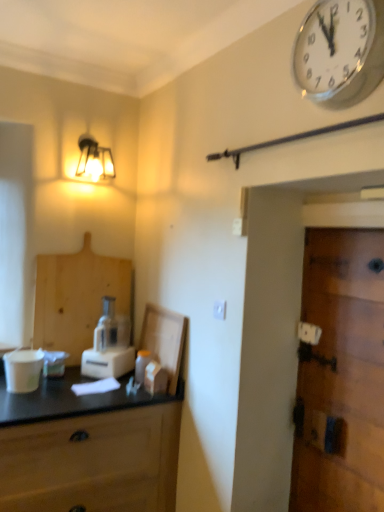
Question: Should I look upward or downward to see white plastic electric outlet at center?

Choices:
 (A) up
 (B) down

Answer: (B)

Question: Does translucent plastic bottle at center turn towards white glossy wall clock at upper right?

Choices:
 (A) no
 (B) yes

Answer: (A)

Question: Is translucent plastic bottle at center smaller than white glossy wall clock at upper right?

Choices:
 (A) yes
 (B) no

Answer: (A)

Question: Would you say translucent plastic bottle at center contains white glossy wall clock at upper right?

Choices:
 (A) yes
 (B) no

Answer: (B)

Question: Is translucent plastic bottle at center next to white glossy wall clock at upper right and touching it?

Choices:
 (A) yes
 (B) no

Answer: (B)

Question: Does translucent plastic bottle at center have a lesser height compared to white glossy wall clock at upper right?

Choices:
 (A) yes
 (B) no

Answer: (A)

Question: Is translucent plastic bottle at center bigger than white glossy wall clock at upper right?

Choices:
 (A) no
 (B) yes

Answer: (A)

Question: From the image's perspective, is wooden cutting board at left on top of white plastic blender at center?

Choices:
 (A) no
 (B) yes

Answer: (B)

Question: Does wooden cutting board at left come in front of white plastic blender at center?

Choices:
 (A) yes
 (B) no

Answer: (B)

Question: Is wooden cutting board at left turned away from white plastic blender at center?

Choices:
 (A) yes
 (B) no

Answer: (A)

Question: Is wooden cutting board at left smaller than white plastic blender at center?

Choices:
 (A) no
 (B) yes

Answer: (B)

Question: Does wooden cutting board at left appear on the right side of white plastic blender at center?

Choices:
 (A) yes
 (B) no

Answer: (B)

Question: Does wooden cutting board at left come behind white plastic blender at center?

Choices:
 (A) no
 (B) yes

Answer: (B)

Question: From a real-world perspective, is wooden door at right on top of matte glass lamp at upper left?

Choices:
 (A) yes
 (B) no

Answer: (B)